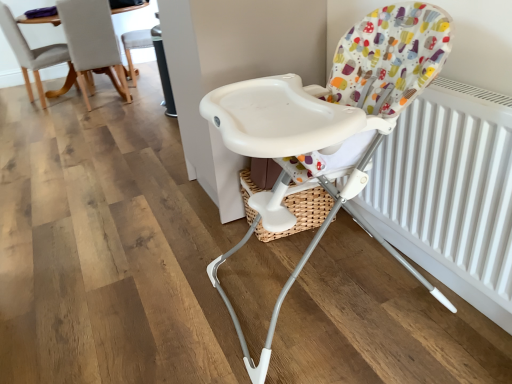
Question: Can you confirm if light gray fabric chair at upper left, which appears as the 2th chair when viewed from the back, is taller than white plastic highchair at center, the 1th chair viewed from the right?

Choices:
 (A) no
 (B) yes

Answer: (A)

Question: Is light gray fabric chair at upper left, the 2th chair positioned from the front, wider than white plastic highchair at center, which is the 1th chair in front-to-back order?

Choices:
 (A) no
 (B) yes

Answer: (A)

Question: Is light gray fabric chair at upper left, the 3th chair in the right-to-left sequence, beside white plastic highchair at center, the 3th chair when ordered from left to right?

Choices:
 (A) no
 (B) yes

Answer: (A)

Question: Is light gray fabric chair at upper left, the 2th chair positioned from the front, looking in the opposite direction of white plastic highchair at center, which is counted as the third chair, starting from the back?

Choices:
 (A) no
 (B) yes

Answer: (A)

Question: From a real-world perspective, is light gray fabric chair at upper left, which appears as the 2th chair when viewed from the back, located beneath white plastic highchair at center, which is the 1th chair in front-to-back order?

Choices:
 (A) yes
 (B) no

Answer: (A)

Question: Is white plastic highchair at center, which is counted as the third chair, starting from the back, bigger or smaller than white plastic chair at upper center, which ranks as the 2th chair in right-to-left order?

Choices:
 (A) big
 (B) small

Answer: (A)

Question: Considering the positions of point (411, 26) and point (138, 39), is point (411, 26) closer or farther from the camera than point (138, 39)?

Choices:
 (A) farther
 (B) closer

Answer: (B)

Question: From their relative heights in the image, would you say white plastic highchair at center, the 1th chair viewed from the right, is taller or shorter than white plastic chair at upper center, which appears as the third chair when viewed from the front?

Choices:
 (A) tall
 (B) short

Answer: (A)

Question: Considering the positions of white plastic highchair at center, which is the 1th chair in front-to-back order, and white plastic chair at upper center, which ranks as the 2th chair in right-to-left order, in the image, is white plastic highchair at center, which is the 1th chair in front-to-back order, wider or thinner than white plastic chair at upper center, which ranks as the 2th chair in right-to-left order,?

Choices:
 (A) thin
 (B) wide

Answer: (B)

Question: From a real-world perspective, is white plastic chair at upper center, which appears as the third chair when viewed from the front, above or below white plastic highchair at center, the 3th chair when ordered from left to right?

Choices:
 (A) above
 (B) below

Answer: (B)

Question: Looking at their shapes, would you say white plastic chair at upper center, the first chair viewed from the back, is wider or thinner than white plastic highchair at center, which is counted as the third chair, starting from the back?

Choices:
 (A) thin
 (B) wide

Answer: (A)

Question: Is white plastic chair at upper center, which is the 2th chair from left to right, taller or shorter than white plastic highchair at center, the 1th chair viewed from the right?

Choices:
 (A) short
 (B) tall

Answer: (A)

Question: Considering the positions of white plastic chair at upper center, the first chair viewed from the back, and white plastic highchair at center, which is counted as the third chair, starting from the back, in the image, is white plastic chair at upper center, the first chair viewed from the back, bigger or smaller than white plastic highchair at center, which is counted as the third chair, starting from the back,?

Choices:
 (A) small
 (B) big

Answer: (A)

Question: Relative to white plastic highchair at center, the 1th chair viewed from the right, is white matte radiator at right in front or behind?

Choices:
 (A) behind
 (B) front

Answer: (A)

Question: Considering the positions of white matte radiator at right and white plastic highchair at center, which is counted as the third chair, starting from the back, in the image, is white matte radiator at right bigger or smaller than white plastic highchair at center, which is counted as the third chair, starting from the back,?

Choices:
 (A) small
 (B) big

Answer: (A)